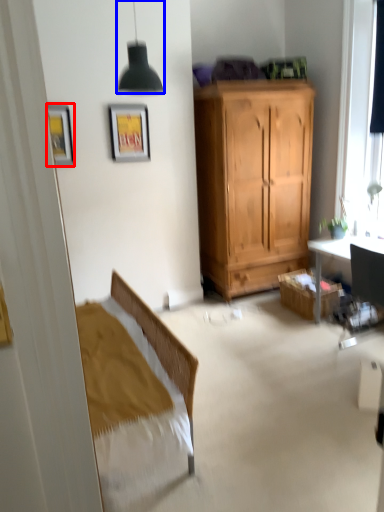
Question: Among these objects, which one is farthest to the camera, picture frame (highlighted by a red box) or lamp (highlighted by a blue box)?

Choices:
 (A) picture frame
 (B) lamp

Answer: (A)